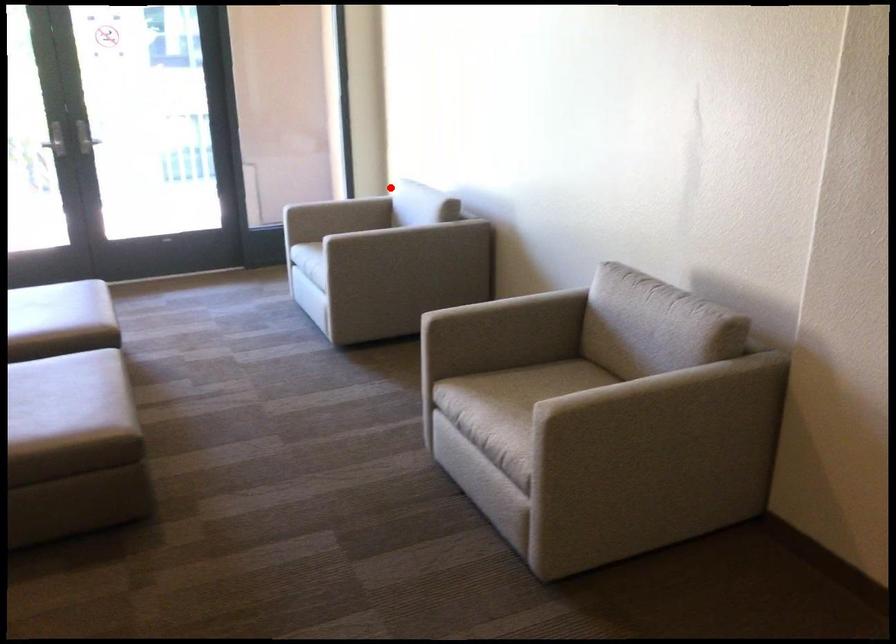
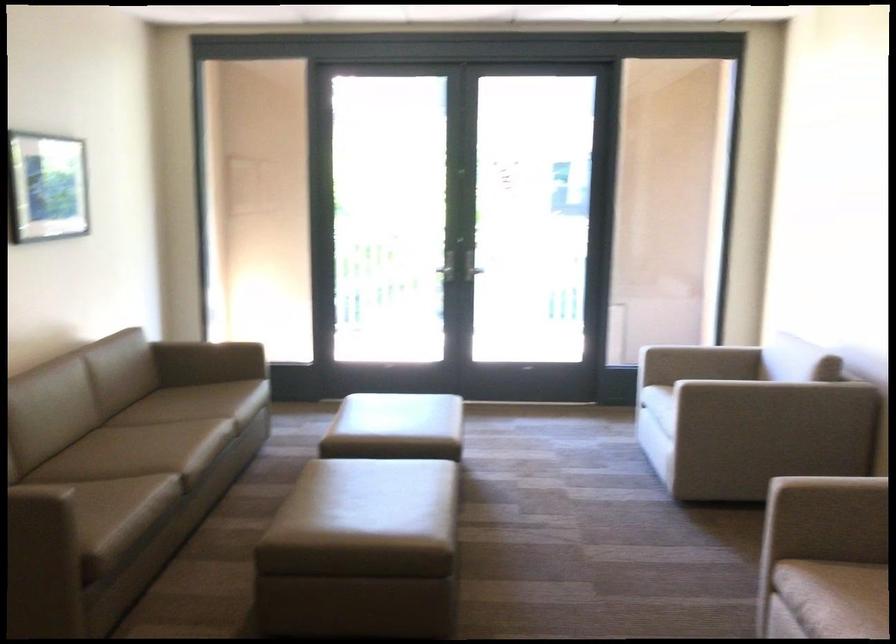
Locate, in the second image, the point that corresponds to the highlighted location in the first image.

(762, 346)